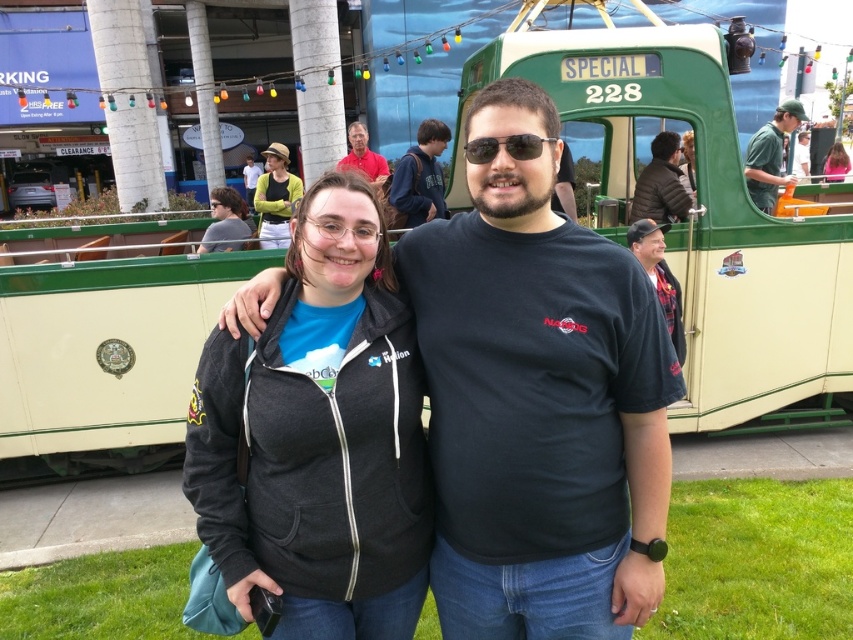
Question: Where is matte green sweater at upper center located in relation to brown hair at center in the image?

Choices:
 (A) right
 (B) left

Answer: (B)

Question: Can you confirm if matte green sweater at upper center is positioned to the right of sunglasses at center?

Choices:
 (A) yes
 (B) no

Answer: (B)

Question: Considering the real-world distances, which object is closest to the matte black jacket at upper center?

Choices:
 (A) plaid fabric shirt at center
 (B) black matte t-shirt at center

Answer: (A)

Question: Among these objects, which one is farthest from the camera?

Choices:
 (A) matte green sweater at upper center
 (B) matte red shirt at upper center
 (C) pink fabric at center
 (D) plaid fabric shirt at center

Answer: (C)

Question: In this image, where is plaid fabric shirt at center located relative to yellow fabric hat at upper center?

Choices:
 (A) right
 (B) left

Answer: (A)

Question: Which of the following is the farthest from the observer?

Choices:
 (A) (843, 163)
 (B) (688, 170)
 (C) (511, 134)

Answer: (A)